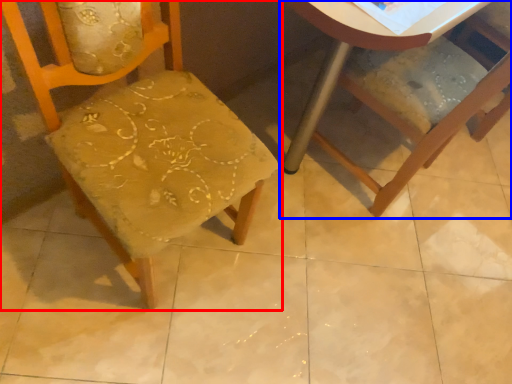
Question: Which of the following is the farthest to the observer, chair (highlighted by a red box) or chair (highlighted by a blue box)?

Choices:
 (A) chair
 (B) chair

Answer: (B)